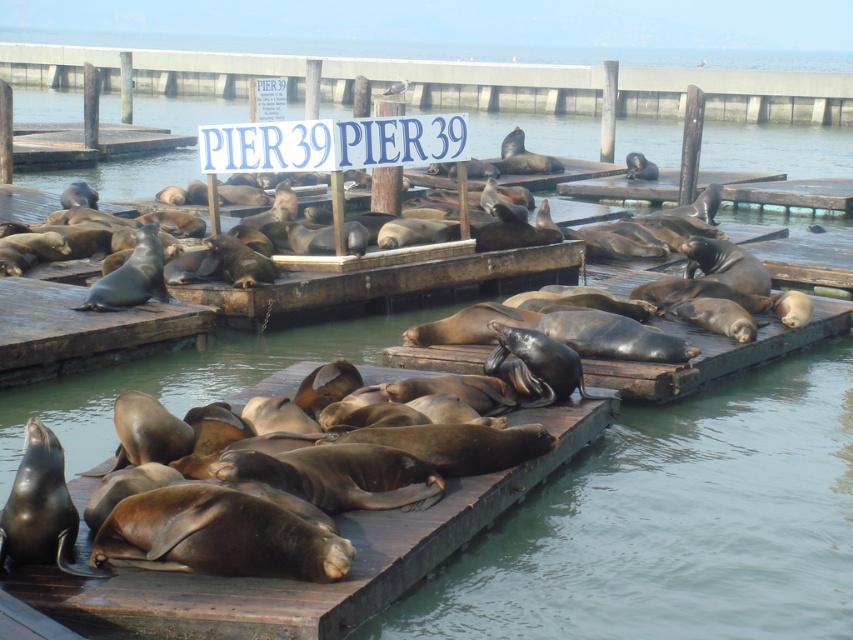
Which is in front, point (61, 45) or point (404, 161)?

Point (404, 161) is in front.

Which of these two, brown wooden dock at center or blue plastic sign at upper center, stands taller?

brown wooden dock at center is taller.

You are a GUI agent. You are given a task and a screenshot of the screen. Output one action in this format:
    pyautogui.click(x=<x>, y=<y>)
    Task: Click on the brown wooden dock at center
    
    Given the screenshot: What is the action you would take?
    pyautogui.click(x=473, y=83)

I want to click on brown wooden dock at center, so click(x=473, y=83).

Does point (454, 552) lie behind point (357, 124)?

No, (454, 552) is closer to viewer.

Is brown matte dock at lower left above blue plastic sign at upper center?

No, brown matte dock at lower left is not above blue plastic sign at upper center.

Which is in front, point (544, 424) or point (273, 145)?

Point (544, 424) is in front.

At what (x,y) coordinates should I click in order to perform the action: click on brown matte dock at lower left. Please return your answer as a coordinate pair (x, y). This screenshot has height=640, width=853. Looking at the image, I should click on (312, 582).

Can you confirm if brown matte dock at lower left is wider than brown wooden dock at center?

In fact, brown matte dock at lower left might be narrower than brown wooden dock at center.

Based on the photo, is brown matte dock at lower left to the right of brown wooden dock at center from the viewer's perspective?

Incorrect, brown matte dock at lower left is not on the right side of brown wooden dock at center.

Is point (91, 609) farther from viewer compared to point (798, 92)?

No, it is not.

Locate an element on the screen. The image size is (853, 640). brown matte dock at lower left is located at coordinates (312, 582).